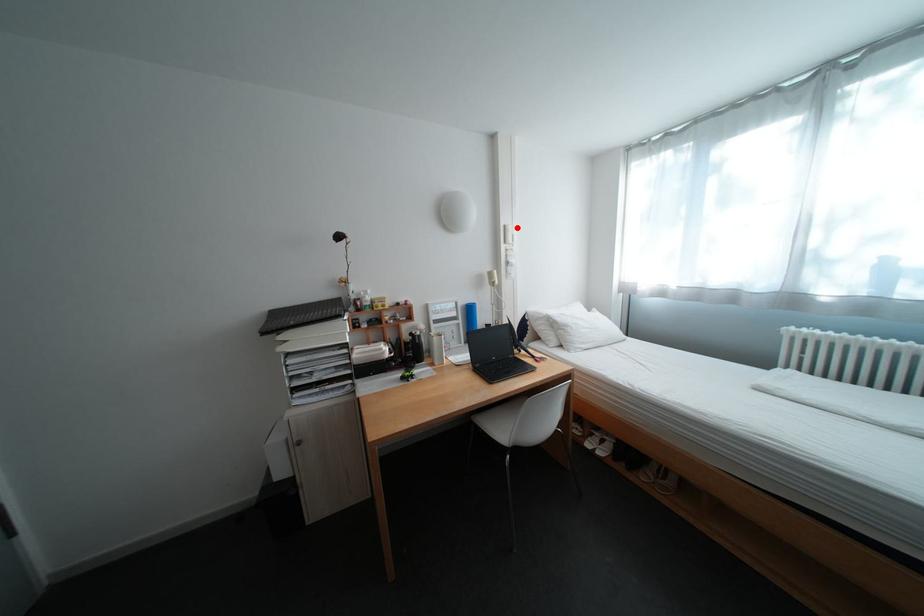
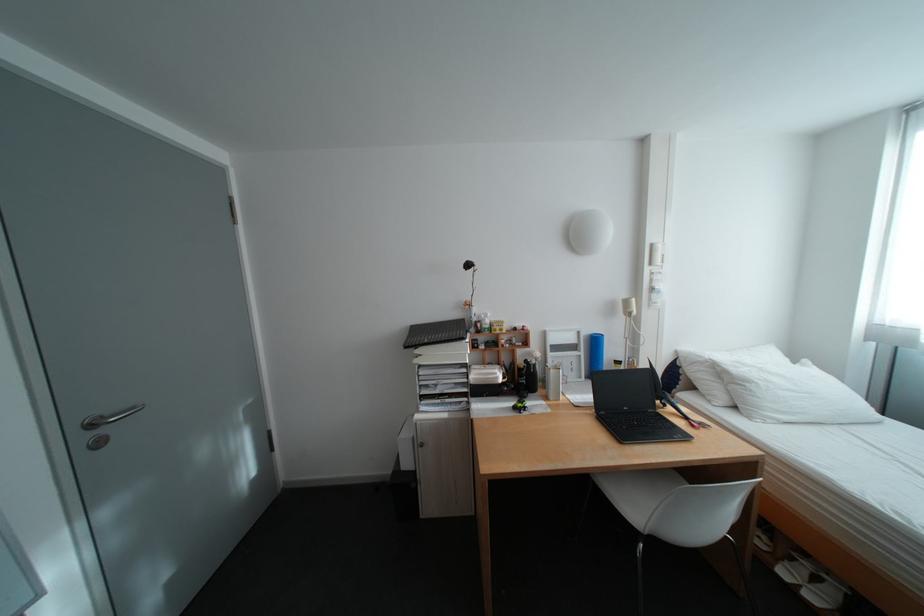
Locate, in the second image, the point that corresponds to the highlighted location in the first image.

(664, 246)